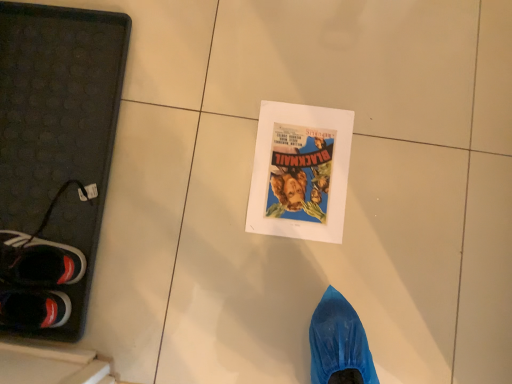
This screenshot has width=512, height=384. Describe the element at coordinates (55, 159) in the screenshot. I see `matte paper flyer at center` at that location.

Where is `matte paper flyer at center`? matte paper flyer at center is located at coordinates (55, 159).

Where is `matte paper flyer at center`? matte paper flyer at center is located at coordinates (55, 159).